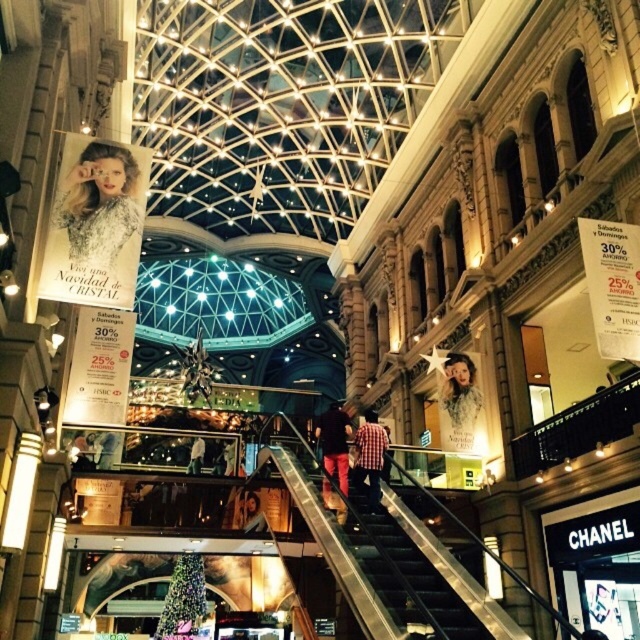
Measure the distance between metallic escalator at center and camera.

metallic escalator at center and camera are 34.92 meters apart.

Between metallic escalator at center and red plaid shirt at center, which one is positioned higher?

Answer: metallic escalator at center is above.

What do you see at coordinates (420, 573) in the screenshot?
I see `metallic escalator at center` at bounding box center [420, 573].

The image size is (640, 640). I want to click on metallic escalator at center, so click(x=420, y=573).

Does metallic silver stairs at center have a larger size compared to multicolored glass christmas tree at lower left?

Indeed, metallic silver stairs at center has a larger size compared to multicolored glass christmas tree at lower left.

Looking at this image, can you confirm if metallic silver stairs at center is smaller than multicolored glass christmas tree at lower left?

Incorrect, metallic silver stairs at center is not smaller in size than multicolored glass christmas tree at lower left.

Identify the location of metallic silver stairs at center. Image resolution: width=640 pixels, height=640 pixels. (378, 561).

Does matte silver poster at upper left have a smaller size compared to red plaid shirt at center?

Yes.

Can you confirm if matte silver poster at upper left is taller than red plaid shirt at center?

No.

Identify the location of matte silver poster at upper left. The height and width of the screenshot is (640, 640). (100, 204).